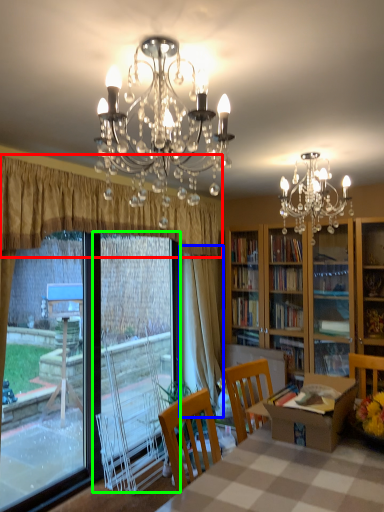
Question: Which is nearer to the curtain (highlighted by a red box)? curtain (highlighted by a blue box) or screen door (highlighted by a green box).

Choices:
 (A) curtain
 (B) screen door

Answer: (A)